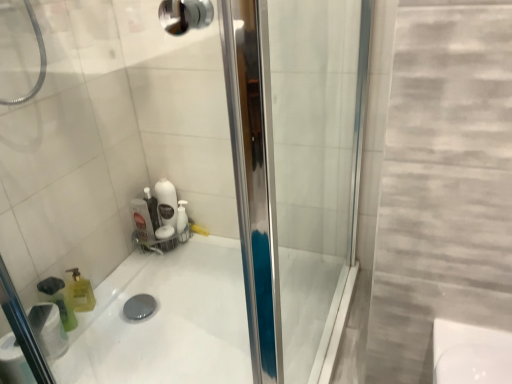
Question: Can you confirm if white matte toilet paper at lower left is wider than white glossy bath at center?

Choices:
 (A) no
 (B) yes

Answer: (A)

Question: From a real-world perspective, is white matte toilet paper at lower left located beneath white glossy bath at center?

Choices:
 (A) yes
 (B) no

Answer: (B)

Question: Is white matte toilet paper at lower left positioned before white glossy bath at center?

Choices:
 (A) no
 (B) yes

Answer: (A)

Question: Considering the relative sizes of white matte toilet paper at lower left and white glossy bath at center in the image provided, is white matte toilet paper at lower left thinner than white glossy bath at center?

Choices:
 (A) yes
 (B) no

Answer: (A)

Question: Could you tell me if white matte toilet paper at lower left is turned towards white glossy bath at center?

Choices:
 (A) yes
 (B) no

Answer: (B)

Question: Considering their positions, is white matte toilet paper at lower left located in front of or behind translucent green bottle at lower left?

Choices:
 (A) behind
 (B) front

Answer: (B)

Question: Considering the positions of white matte toilet paper at lower left and translucent green bottle at lower left in the image, is white matte toilet paper at lower left wider or thinner than translucent green bottle at lower left?

Choices:
 (A) wide
 (B) thin

Answer: (A)

Question: Is white matte toilet paper at lower left situated inside translucent green bottle at lower left or outside?

Choices:
 (A) outside
 (B) inside

Answer: (A)

Question: Based on their sizes in the image, would you say white matte toilet paper at lower left is bigger or smaller than translucent green bottle at lower left?

Choices:
 (A) big
 (B) small

Answer: (B)

Question: Looking at the image, does translucent green bottle at lower left seem bigger or smaller compared to white matte toilet paper at lower left?

Choices:
 (A) small
 (B) big

Answer: (B)

Question: Would you say translucent green bottle at lower left is to the left or to the right of white matte toilet paper at lower left in the picture?

Choices:
 (A) left
 (B) right

Answer: (B)

Question: From the image's perspective, is translucent green bottle at lower left positioned above or below white matte toilet paper at lower left?

Choices:
 (A) above
 (B) below

Answer: (A)

Question: Considering the positions of translucent green bottle at lower left and white matte toilet paper at lower left in the image, is translucent green bottle at lower left taller or shorter than white matte toilet paper at lower left?

Choices:
 (A) short
 (B) tall

Answer: (B)

Question: From a real-world perspective, is white glossy bath at center positioned above or below white matte toilet paper at lower left?

Choices:
 (A) below
 (B) above

Answer: (A)

Question: Looking at their shapes, would you say white glossy bath at center is wider or thinner than white matte toilet paper at lower left?

Choices:
 (A) wide
 (B) thin

Answer: (A)